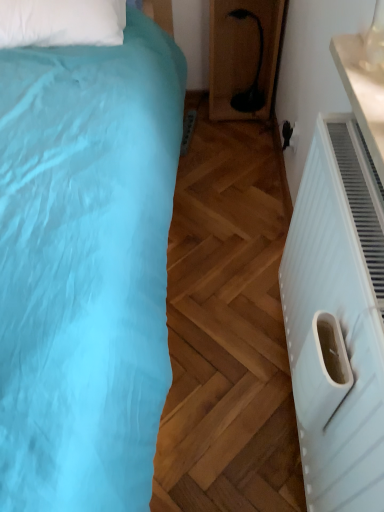
What do you see at coordinates (242, 55) in the screenshot?
I see `black flexible neck lamp at center` at bounding box center [242, 55].

Identify the location of black flexible neck lamp at center. This screenshot has height=512, width=384. (242, 55).

What is the approximate width of black flexible neck lamp at center?

black flexible neck lamp at center is 10.31 inches in width.

This screenshot has height=512, width=384. Find the location of `black flexible neck lamp at center`. black flexible neck lamp at center is located at coordinates (242, 55).